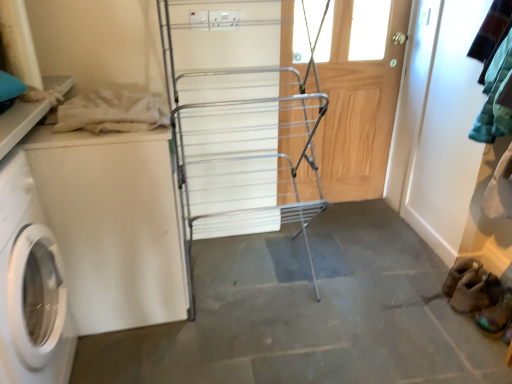
Where is `free region on the left part of brown suede shoe at lower right, arranged as the first shoe when viewed from the back`? The height and width of the screenshot is (384, 512). free region on the left part of brown suede shoe at lower right, arranged as the first shoe when viewed from the back is located at coordinates (433, 313).